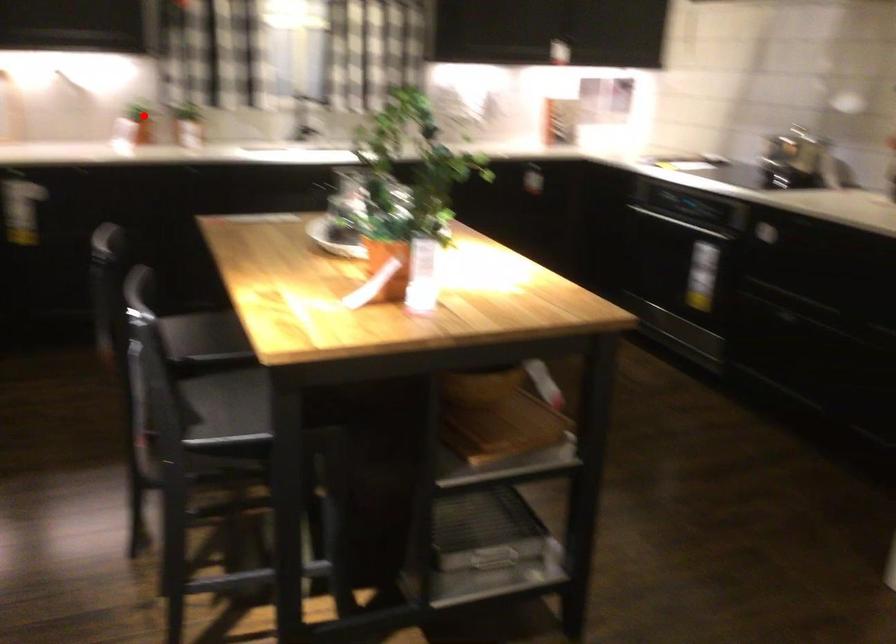
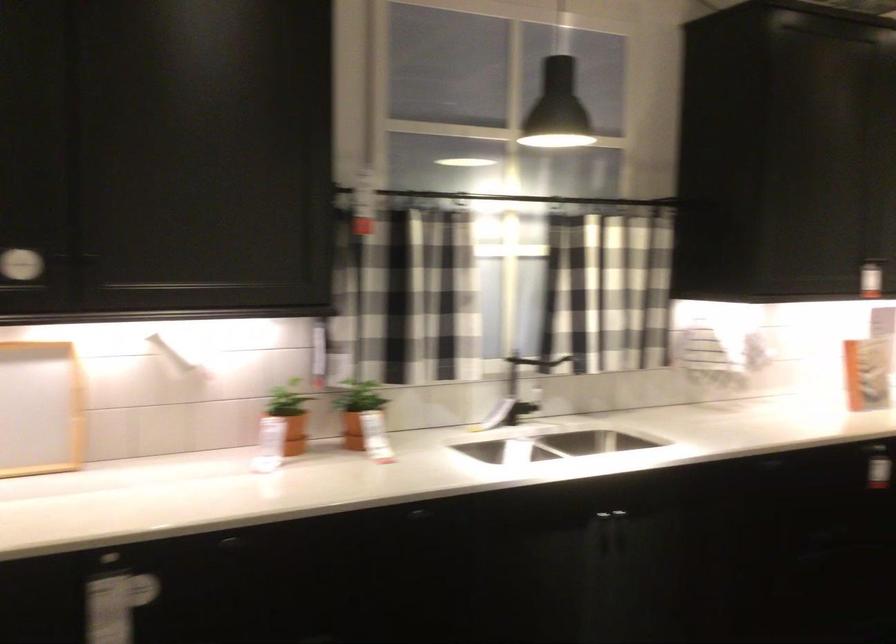
Locate, in the second image, the point that corresponds to the highlighted location in the first image.

(289, 415)